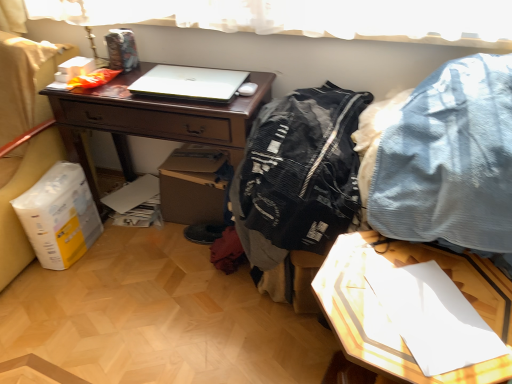
Locate an element on the screen. matte brown desk at center is located at coordinates pyautogui.click(x=152, y=119).

Locate an element on the screen. The width and height of the screenshot is (512, 384). white glossy paper at lower right is located at coordinates (386, 315).

What is the approximate height of white glossy paper at lower right?

white glossy paper at lower right is 54.29 centimeters in height.

Describe the element at coordinates (190, 83) in the screenshot. I see `white matte laptop at center` at that location.

The image size is (512, 384). What are the coordinates of `matte brown desk at center` in the screenshot? It's located at (152, 119).

Find the location of a particular element. the 2nd clothing positioned below the matte brown desk at center (from the image's perspective) is located at coordinates (303, 168).

Between black mesh jacket at center, which is counted as the 2th clothing, starting from the right, and matte brown desk at center, which one has larger width?

Wider between the two is black mesh jacket at center, which is counted as the 2th clothing, starting from the right.

Which is in front, point (275, 171) or point (119, 155)?

The point (275, 171) is more forward.

Are black mesh jacket at center, which is counted as the 2th clothing, starting from the right, and matte brown desk at center beside each other?

No, black mesh jacket at center, which is counted as the 2th clothing, starting from the right, is not touching matte brown desk at center.

Does black mesh jacket at center, the 1th clothing when ordered from left to right, have a larger size compared to white glossy paper at lower right?

Incorrect, black mesh jacket at center, the 1th clothing when ordered from left to right, is not larger than white glossy paper at lower right.

Which object is thinner, black mesh jacket at center, the 1th clothing when ordered from left to right, or white glossy paper at lower right?

Thinner between the two is white glossy paper at lower right.

From the picture: Is black mesh jacket at center, which is counted as the 2th clothing, starting from the right, aimed at white glossy paper at lower right?

No, black mesh jacket at center, which is counted as the 2th clothing, starting from the right, is not aimed at white glossy paper at lower right.

Between black mesh jacket at center, the 1th clothing when ordered from left to right, and white glossy paper at lower right, which one has less height?

white glossy paper at lower right is shorter.

Based on their sizes in the image, would you say denim fabric pants at upper right, acting as the 2th clothing starting from the left, is bigger or smaller than black mesh jacket at center, the 1th clothing when ordered from left to right?

In the image, denim fabric pants at upper right, acting as the 2th clothing starting from the left, appears to be larger than black mesh jacket at center, the 1th clothing when ordered from left to right.

Consider the image. Would you say denim fabric pants at upper right, acting as the 2th clothing starting from the left, is to the left or to the right of black mesh jacket at center, the 1th clothing when ordered from left to right, in the picture?

Based on their positions, denim fabric pants at upper right, acting as the 2th clothing starting from the left, is located to the right of black mesh jacket at center, the 1th clothing when ordered from left to right.

From a real-world perspective, is denim fabric pants at upper right, acting as the 2th clothing starting from the left, positioned above or below black mesh jacket at center, which is counted as the 2th clothing, starting from the right?

From a real-world perspective, denim fabric pants at upper right, acting as the 2th clothing starting from the left, is physically above black mesh jacket at center, which is counted as the 2th clothing, starting from the right.

Is denim fabric pants at upper right, the first clothing when ordered from right to left, next to white glossy paper at lower right?

denim fabric pants at upper right, the first clothing when ordered from right to left, and white glossy paper at lower right are clearly separated.

Is denim fabric pants at upper right, the first clothing when ordered from right to left, in front of or behind white glossy paper at lower right in the image?

Clearly, denim fabric pants at upper right, the first clothing when ordered from right to left, is behind white glossy paper at lower right.

From a real-world perspective, does denim fabric pants at upper right, the first clothing when ordered from right to left, stand above white glossy paper at lower right?

Yes, from a real-world perspective, denim fabric pants at upper right, the first clothing when ordered from right to left, is above white glossy paper at lower right.

Would you say white glossy paper at lower right is part of denim fabric pants at upper right, the first clothing when ordered from right to left,'s contents?

No, denim fabric pants at upper right, the first clothing when ordered from right to left, does not contain white glossy paper at lower right.

Based on the photo, are black mesh jacket at center, which is counted as the 2th clothing, starting from the right, and white matte laptop at center far apart?

black mesh jacket at center, which is counted as the 2th clothing, starting from the right, is near white matte laptop at center, not far away.

Can you confirm if black mesh jacket at center, the 1th clothing when ordered from left to right, is positioned to the left of white matte laptop at center?

In fact, black mesh jacket at center, the 1th clothing when ordered from left to right, is to the right of white matte laptop at center.

Based on the photo, from the image's perspective, is black mesh jacket at center, which is counted as the 2th clothing, starting from the right, above or below white matte laptop at center?

black mesh jacket at center, which is counted as the 2th clothing, starting from the right, is below white matte laptop at center.

The image size is (512, 384). In the image, there is a black mesh jacket at center, which is counted as the 2th clothing, starting from the right. Find the location of `laptop above it (from the image's perspective)`. laptop above it (from the image's perspective) is located at coordinates (190, 83).

Based on the photo, is white glossy paper at lower right situated inside black mesh jacket at center, the 1th clothing when ordered from left to right, or outside?

white glossy paper at lower right cannot be found inside black mesh jacket at center, the 1th clothing when ordered from left to right.

From a real-world perspective, is white glossy paper at lower right over black mesh jacket at center, the 1th clothing when ordered from left to right?

Actually, white glossy paper at lower right is physically below black mesh jacket at center, the 1th clothing when ordered from left to right, in the real world.

Where is `clothing that is the 1st object located above the white glossy paper at lower right (from the image's perspective)`? This screenshot has width=512, height=384. clothing that is the 1st object located above the white glossy paper at lower right (from the image's perspective) is located at coordinates (303, 168).

Between matte brown desk at center and black mesh jacket at center, which is counted as the 2th clothing, starting from the right, which one appears on the right side from the viewer's perspective?

From the viewer's perspective, black mesh jacket at center, which is counted as the 2th clothing, starting from the right, appears more on the right side.

Would you say matte brown desk at center contains black mesh jacket at center, which is counted as the 2th clothing, starting from the right?

That's incorrect, black mesh jacket at center, which is counted as the 2th clothing, starting from the right, is not inside matte brown desk at center.

From the image's perspective, between matte brown desk at center and black mesh jacket at center, which is counted as the 2th clothing, starting from the right, which one is located above?

matte brown desk at center is shown above in the image.

In the image, is matte brown desk at center positioned in front of or behind black mesh jacket at center, which is counted as the 2th clothing, starting from the right?

Visually, matte brown desk at center is located behind black mesh jacket at center, which is counted as the 2th clothing, starting from the right.

Where is `desk behind the black mesh jacket at center, the 1th clothing when ordered from left to right`? desk behind the black mesh jacket at center, the 1th clothing when ordered from left to right is located at coordinates (152, 119).

You are a GUI agent. You are given a task and a screenshot of the screen. Output one action in this format:
    pyautogui.click(x=<x>, y=<y>)
    Task: Click on the 1st clothing directly above the white glossy paper at lower right (from a real-world perspective)
    
    Given the screenshot: What is the action you would take?
    pyautogui.click(x=303, y=168)

When comparing their distances from white glossy paper at lower right, does white matte laptop at center or black mesh jacket at center, which is counted as the 2th clothing, starting from the right, seem further?

Based on the image, white matte laptop at center appears to be further to white glossy paper at lower right.

Looking at the image, which one is located further to matte brown desk at center, denim fabric pants at upper right, acting as the 2th clothing starting from the left, or white matte laptop at center?

The object further to matte brown desk at center is denim fabric pants at upper right, acting as the 2th clothing starting from the left.

Consider the image. From the image, which object appears to be farther from denim fabric pants at upper right, acting as the 2th clothing starting from the left, white matte laptop at center or white glossy paper at lower right?

Based on the image, white matte laptop at center appears to be further to denim fabric pants at upper right, acting as the 2th clothing starting from the left.

Which object lies further to the anchor point white glossy paper at lower right, black mesh jacket at center, the 1th clothing when ordered from left to right, or denim fabric pants at upper right, acting as the 2th clothing starting from the left?

The object further to white glossy paper at lower right is black mesh jacket at center, the 1th clothing when ordered from left to right.

Which object lies further to the anchor point white glossy paper at lower right, denim fabric pants at upper right, the first clothing when ordered from right to left, or black mesh jacket at center, which is counted as the 2th clothing, starting from the right?

black mesh jacket at center, which is counted as the 2th clothing, starting from the right, is positioned further to the anchor white glossy paper at lower right.

Looking at the image, which one is located further to denim fabric pants at upper right, acting as the 2th clothing starting from the left, white matte laptop at center or black mesh jacket at center, the 1th clothing when ordered from left to right?

Answer: Based on the image, white matte laptop at center appears to be further to denim fabric pants at upper right, acting as the 2th clothing starting from the left.

In the scene shown: From the image, which object appears to be farther from denim fabric pants at upper right, acting as the 2th clothing starting from the left, white matte laptop at center or matte brown desk at center?

The object further to denim fabric pants at upper right, acting as the 2th clothing starting from the left, is white matte laptop at center.

Based on their spatial positions, is black mesh jacket at center, which is counted as the 2th clothing, starting from the right, or white matte laptop at center further from white glossy paper at lower right?

white matte laptop at center lies further to white glossy paper at lower right than the other object.

The width and height of the screenshot is (512, 384). Find the location of `clothing between white matte laptop at center and denim fabric pants at upper right, the first clothing when ordered from right to left, from left to right`. clothing between white matte laptop at center and denim fabric pants at upper right, the first clothing when ordered from right to left, from left to right is located at coordinates (303, 168).

Locate an element on the screen. table between matte brown desk at center and denim fabric pants at upper right, the first clothing when ordered from right to left, in the horizontal direction is located at coordinates (386, 315).

I want to click on clothing between denim fabric pants at upper right, acting as the 2th clothing starting from the left, and white glossy paper at lower right, in the vertical direction, so click(x=303, y=168).

At what (x,y) coordinates should I click in order to perform the action: click on laptop between matte brown desk at center and black mesh jacket at center, the 1th clothing when ordered from left to right, in the horizontal direction. Please return your answer as a coordinate pair (x, y). Looking at the image, I should click on (190, 83).